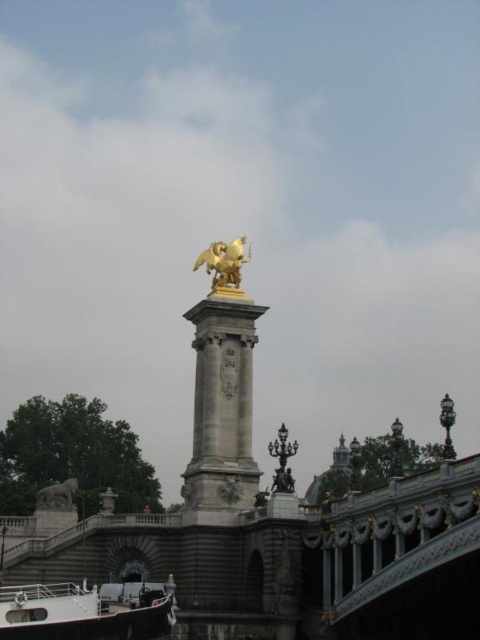
You are standing on the bridge and want to walk towards the golden statue of the winged horse. Which point, point (164, 632) or point (215, 276), is closer to the statue?

Point (164, 632) is closer to the golden statue of the winged horse because it is in front of point (215, 276).

Consider the image. You are standing at the base of the bridge structure and want to take a photo of the golden statue of the winged horse. The camera you are using has a focal length of 50mm. If you want to capture the entire structure in your photo, including the point at coordinates point (x=216, y=403), which is 299.57 feet away from the camera, what is the minimum distance you should be from the structure to ensure the entire scene fits in the frame?

To capture the entire structure including the point (x=216, y=403), which is 299.57 feet away from the camera, you should position yourself at least 299.57 feet away from the structure. This ensures the focal length of 50mm can adequately frame the scene without cropping any part of the structure.

You are an architect designing a miniature model of this scene. You need to ensure that the white matte boat at lower left and the gold polished statue at upper center maintain their relative sizes. Which object should be made larger in the model?

The white matte boat at lower left should be made larger in the model since it is taller than the gold polished statue at upper center in the original scene.